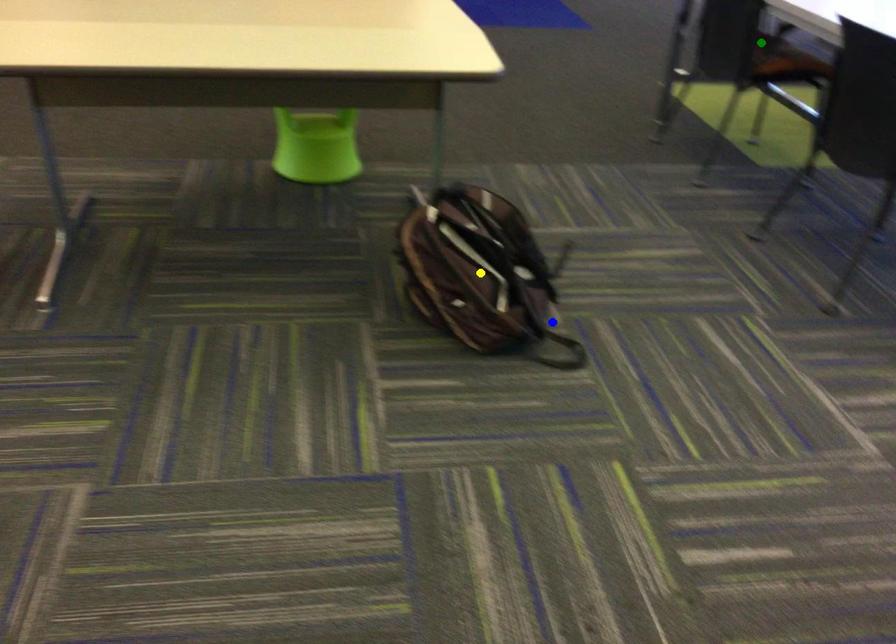
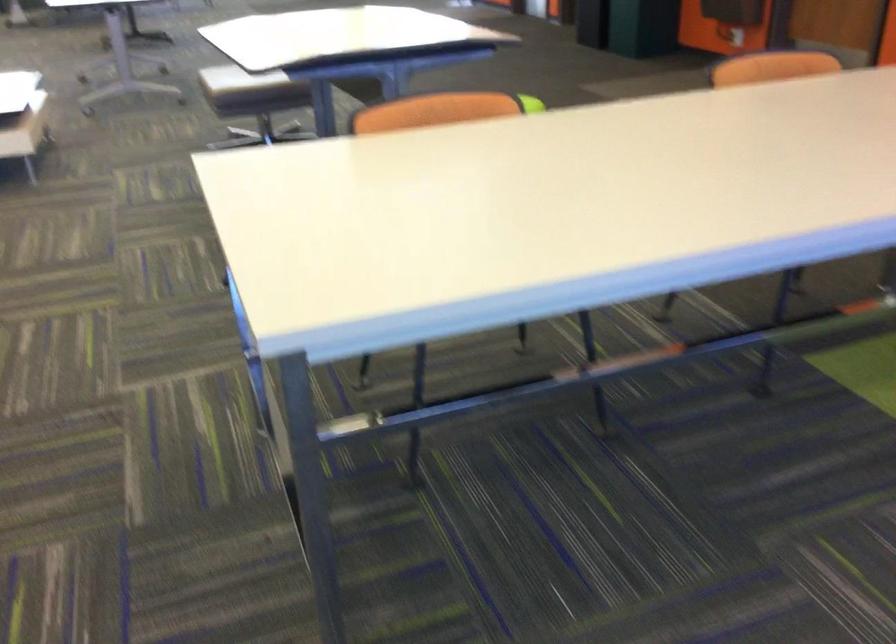
I am providing you with two images of the same scene from different viewpoints. Three points are marked in image1. Which point corresponds to a part or object that is occluded in image2?In image1, three points are marked. Which of them correspond to a part or object that is occluded in image2?Among the three points shown in image1, which one corresponds to a part or object that is no longer visible due to occlusion in image2?

Invisible in image2: yellow point, blue point, green point.